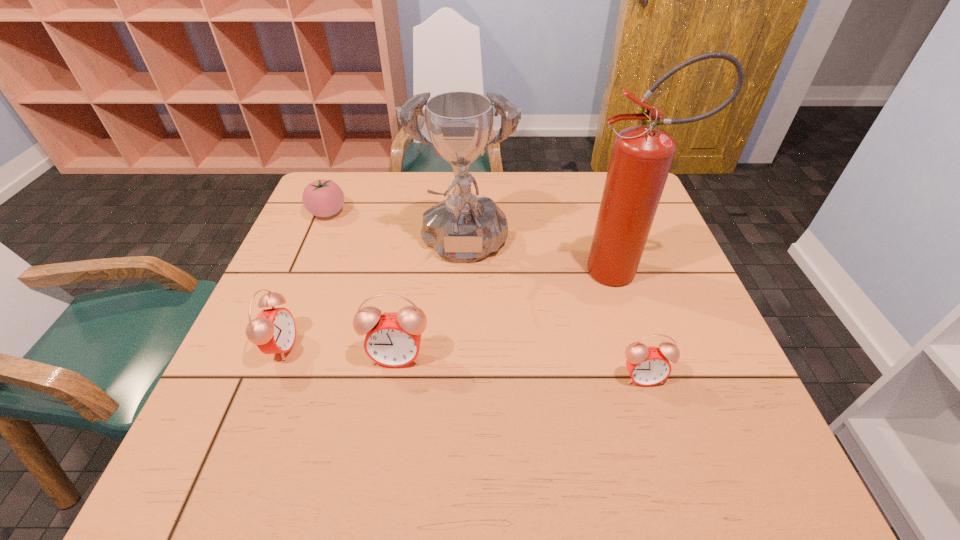
Where is `free spot between the second alarm clock from right to left and the fire extinguisher`? free spot between the second alarm clock from right to left and the fire extinguisher is located at coordinates (510, 313).

The image size is (960, 540). Find the location of `free point between the shortest alarm clock and the leftmost alarm clock`. free point between the shortest alarm clock and the leftmost alarm clock is located at coordinates (462, 361).

Locate an element on the screen. The image size is (960, 540). vacant space in between the fire extinguisher and the second tallest object is located at coordinates (543, 261).

The width and height of the screenshot is (960, 540). Find the location of `empty location between the tallest object and the leftmost alarm clock`. empty location between the tallest object and the leftmost alarm clock is located at coordinates (452, 308).

Identify the location of free space between the second alarm clock from left to right and the tallest object. (510, 313).

Where is `empty space between the rightmost alarm clock and the second alarm clock from right to left`? The width and height of the screenshot is (960, 540). empty space between the rightmost alarm clock and the second alarm clock from right to left is located at coordinates (519, 366).

Select which object is the closest to the second alarm clock from left to right. Please provide its 2D coordinates. Your answer should be formatted as a tuple, i.e. [(x, y)], where the tuple contains the x and y coordinates of a point satisfying the conditions above.

[(273, 330)]

Where is `object that is the fifth closest to the leftmost alarm clock`? The height and width of the screenshot is (540, 960). object that is the fifth closest to the leftmost alarm clock is located at coordinates (647, 365).

Identify which alarm clock is the second nearest to the second alarm clock from right to left. Please provide its 2D coordinates. Your answer should be formatted as a tuple, i.e. [(x, y)], where the tuple contains the x and y coordinates of a point satisfying the conditions above.

[(647, 365)]

Where is `alarm clock that can be found as the second closest to the tallest object`? alarm clock that can be found as the second closest to the tallest object is located at coordinates (392, 339).